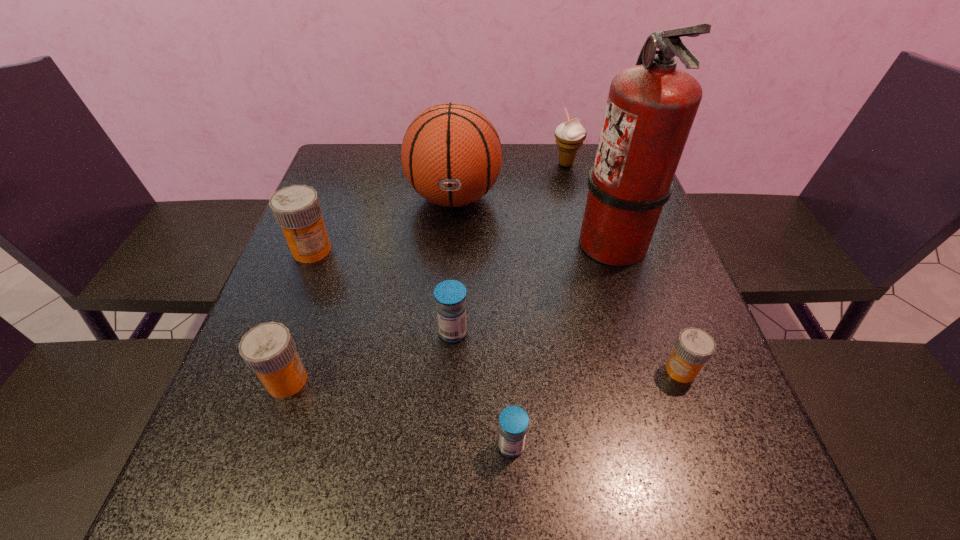
What are the coordinates of `orange medicine object that ranks as the second closest to the second smallest orange medicine` in the screenshot? It's located at (694, 347).

You are a GUI agent. You are given a task and a screenshot of the screen. Output one action in this format:
    pyautogui.click(x=<x>, y=<y>)
    Task: Click on the blank area in the image that satisfies the following two spatial constraints: 1. on the side where the inflation valve is located; 2. on the left side of the left blue medicine
    This screenshot has width=960, height=540.
    Given the screenshot: What is the action you would take?
    point(444,333)

Locate an element on the screen. The image size is (960, 540). blank space that satisfies the following two spatial constraints: 1. on the side where the inflation valve is located; 2. on the right side of the fourth medicine from left to right is located at coordinates tap(437, 446).